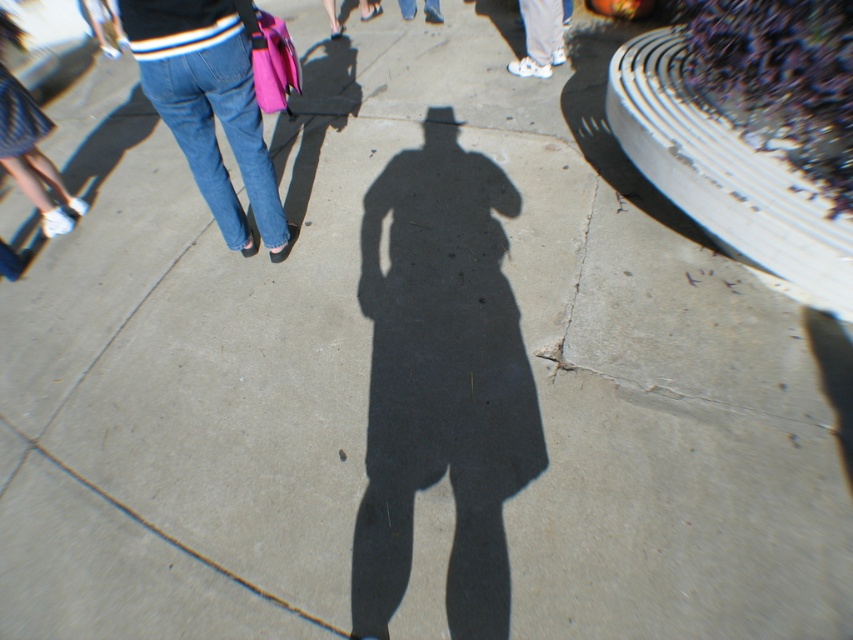
Does white matte sneakers at upper right have a greater width compared to blue denim jeans at center?

A: Correct, the width of white matte sneakers at upper right exceeds that of blue denim jeans at center.

Looking at this image, does white matte sneakers at upper right come behind blue denim jeans at center?

No, white matte sneakers at upper right is in front of blue denim jeans at center.

Where is `white matte sneakers at upper right`? white matte sneakers at upper right is located at coordinates (540, 38).

Identify the location of white matte sneakers at upper right. (540, 38).

Is point (260, 180) in front of point (427, 0)?

Yes, it is.

Can you confirm if denim jeans at center is positioned to the left of blue denim jeans at center?

Yes, denim jeans at center is to the left of blue denim jeans at center.

Is point (223, 166) behind point (428, 0)?

No, (223, 166) is in front of (428, 0).

I want to click on denim jeans at center, so click(x=213, y=134).

Measure the distance from denim jeans at center to white matte sneakers at upper right.

8.92 feet

Between denim jeans at center and white matte sneakers at upper right, which one is positioned lower?

denim jeans at center

This screenshot has width=853, height=640. In order to click on denim jeans at center in this screenshot , I will do `click(213, 134)`.

The image size is (853, 640). What are the coordinates of `denim jeans at center` in the screenshot? It's located at (213, 134).